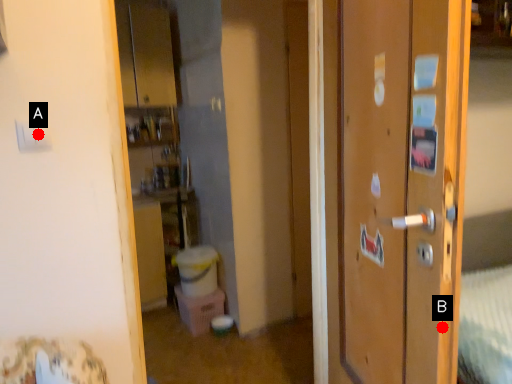
Question: Two points are circled on the image, labeled by A and B beside each circle. Which of the following is the closest to the observer?

Choices:
 (A) A is closer
 (B) B is closer

Answer: (B)